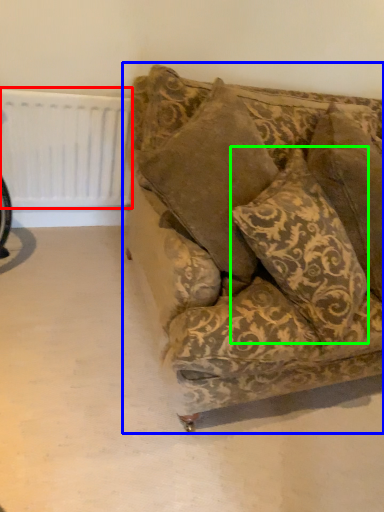
Question: Based on their relative distances, which object is nearer to radiator (highlighted by a red box)? Choose from studio couch (highlighted by a blue box) and pillow (highlighted by a green box).

Choices:
 (A) studio couch
 (B) pillow

Answer: (A)